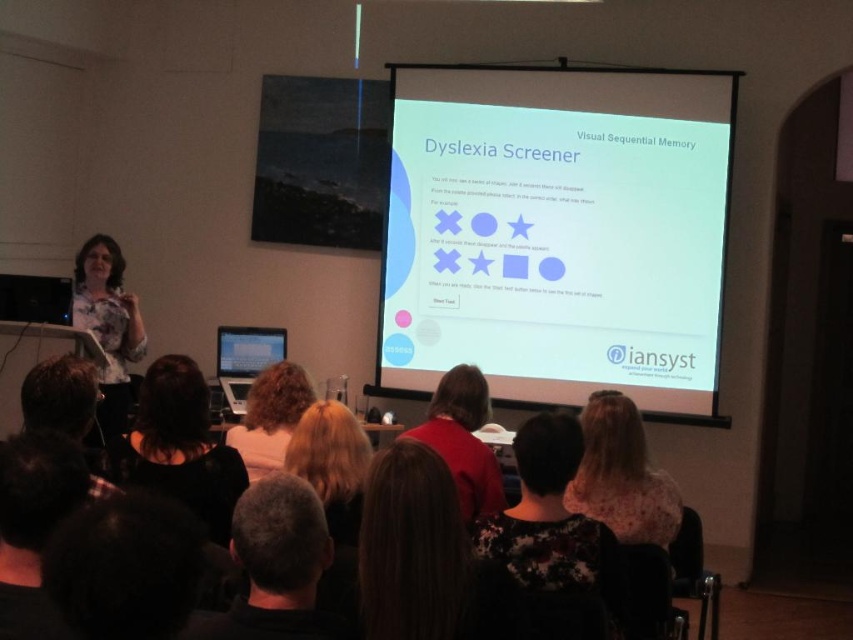
You are an attendee at the presentation and want to take a photo of the white glossy projector screen at center and the dark brown hair at lower center for your notes. Which object will appear larger in your photo?

The white glossy projector screen at center will appear larger in the photo because it is much taller than the dark brown hair at lower center.

Based on the photo, you are an attendee at the presentation and need to read the instructions on the white glossy projector screen at center. The red sweater at center is blocking your view. Can you estimate if the screen is large enough to read the text even with the sweater partially covering it?

The white glossy projector screen at center is larger than the red sweater at center, so even if the sweater partially covers it, there should still be enough visible area to read the text.